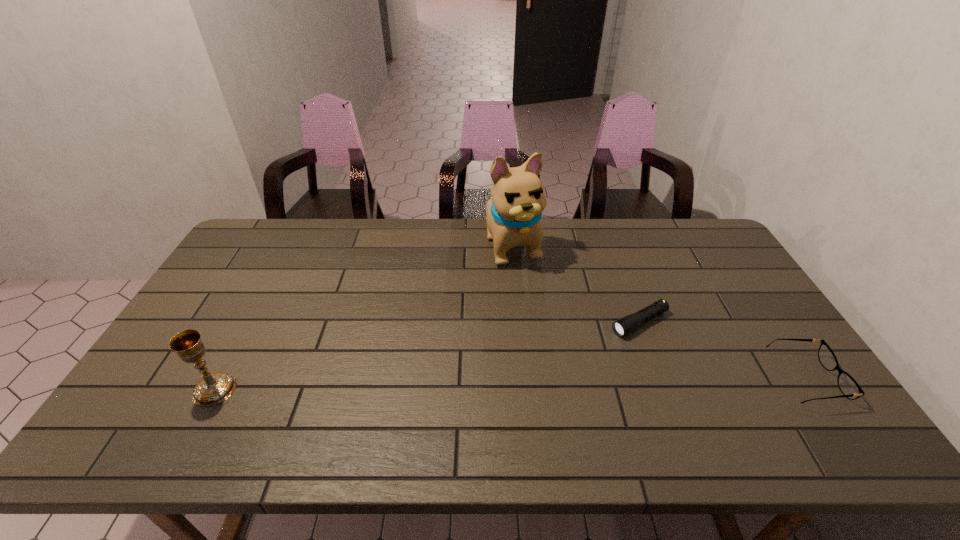
The width and height of the screenshot is (960, 540). In order to click on vacant space that satisfies the following two spatial constraints: 1. on the front side of the flashlight; 2. on the front-facing side of the spectacles in this screenshot , I will do 660,379.

I want to click on blank space that satisfies the following two spatial constraints: 1. on the front side of the tallest object; 2. on the front-facing side of the third tallest object, so click(x=525, y=379).

The width and height of the screenshot is (960, 540). In order to click on free space in the image that satisfies the following two spatial constraints: 1. on the front side of the third tallest object; 2. on the front-facing side of the tallest object in this screenshot , I will do `click(525, 379)`.

This screenshot has width=960, height=540. Find the location of `vacant space that satisfies the following two spatial constraints: 1. on the back side of the second tallest object; 2. on the left side of the second object from right to left`. vacant space that satisfies the following two spatial constraints: 1. on the back side of the second tallest object; 2. on the left side of the second object from right to left is located at coordinates (251, 323).